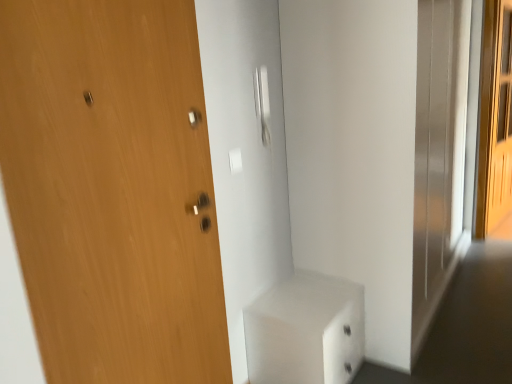
Measure the distance between white glossy cabinet at lower center and camera.

white glossy cabinet at lower center is 1.84 meters away from camera.

Image resolution: width=512 pixels, height=384 pixels. What do you see at coordinates (305, 331) in the screenshot?
I see `white glossy cabinet at lower center` at bounding box center [305, 331].

What do you see at coordinates (495, 123) in the screenshot?
I see `light brown wooden screen door at right` at bounding box center [495, 123].

What is the approximate width of wooden door at left?

1.72 inches.

What do you see at coordinates (262, 103) in the screenshot?
I see `satin silver door handle at center` at bounding box center [262, 103].

The image size is (512, 384). What are the coordinates of `white glossy cabinet at lower center` in the screenshot? It's located at (305, 331).

Does wooden door at left appear on the left side of satin silver door handle at center?

Yes.

Which is behind, point (68, 149) or point (262, 112)?

Positioned behind is point (262, 112).

Consider the image. Do you think wooden door at left is within satin silver door handle at center, or outside of it?

wooden door at left cannot be found inside satin silver door handle at center.

There is a wooden door at left. Identify the location of door handle above it (from a real-world perspective). This screenshot has width=512, height=384. (262, 103).

Can you tell me how much wooden door at left and white glossy cabinet at lower center differ in facing direction?

wooden door at left and white glossy cabinet at lower center are facing 0.00453 degrees away from each other.

Which of these two, wooden door at left or white glossy cabinet at lower center, is smaller?

wooden door at left is smaller.

Which point is more forward, (213, 215) or (336, 317)?

The point (213, 215) is more forward.

Where is `cabinetry on the right of wooden door at left`? The width and height of the screenshot is (512, 384). cabinetry on the right of wooden door at left is located at coordinates (305, 331).

Which of these two, light brown wooden screen door at right or white glossy cabinet at lower center, is bigger?

light brown wooden screen door at right is bigger.

Where is `cabinetry in front of the light brown wooden screen door at right`? The width and height of the screenshot is (512, 384). cabinetry in front of the light brown wooden screen door at right is located at coordinates (305, 331).

Which is correct: light brown wooden screen door at right is inside white glossy cabinet at lower center, or outside of it?

light brown wooden screen door at right is outside white glossy cabinet at lower center.

In terms of width, does light brown wooden screen door at right look wider or thinner when compared to white glossy cabinet at lower center?

Clearly, light brown wooden screen door at right has less width compared to white glossy cabinet at lower center.

From a real-world perspective, is white glossy cabinet at lower center physically above light brown wooden screen door at right?

Actually, white glossy cabinet at lower center is physically below light brown wooden screen door at right in the real world.

Does white glossy cabinet at lower center appear on the left side of light brown wooden screen door at right?

Correct, you'll find white glossy cabinet at lower center to the left of light brown wooden screen door at right.

How distant is white glossy cabinet at lower center from light brown wooden screen door at right?

They are 2.56 meters apart.

Is white glossy cabinet at lower center placed right next to light brown wooden screen door at right?

No, white glossy cabinet at lower center is not next to light brown wooden screen door at right.

Does white glossy cabinet at lower center turn towards wooden door at left?

No.

From the image's perspective, is white glossy cabinet at lower center located above wooden door at left?

No.

How much distance is there between white glossy cabinet at lower center and wooden door at left?

white glossy cabinet at lower center and wooden door at left are 30.67 inches apart from each other.

In the scene shown: Does white glossy cabinet at lower center touch wooden door at left?

No, white glossy cabinet at lower center is not in contact with wooden door at left.

Can you see satin silver door handle at center touching wooden door at left?

No, satin silver door handle at center is not with wooden door at left.

Looking at this image, what's the angular difference between satin silver door handle at center and wooden door at left's facing directions?

0.00823 degrees separate the facing orientations of satin silver door handle at center and wooden door at left.

Which is less distant, (255,92) or (85,24)?

Point (255,92) appears to be farther away from the viewer than point (85,24).

Looking at this image, is satin silver door handle at center positioned with its back to wooden door at left?

No, satin silver door handle at center is not facing the opposite direction of wooden door at left.

Is light brown wooden screen door at right beside wooden door at left?

light brown wooden screen door at right and wooden door at left are not in contact.

From the image's perspective, which one is positioned lower, light brown wooden screen door at right or wooden door at left?

wooden door at left appears lower in the image.

The width and height of the screenshot is (512, 384). Find the location of `door handle that appears behind the wooden door at left`. door handle that appears behind the wooden door at left is located at coordinates (262, 103).

The height and width of the screenshot is (384, 512). I want to click on cabinetry on the right of wooden door at left, so click(x=305, y=331).

Consider the image. When comparing their distances from wooden door at left, does white glossy cabinet at lower center or satin silver door handle at center seem closer?

Based on the image, white glossy cabinet at lower center appears to be nearer to wooden door at left.

Based on their spatial positions, is satin silver door handle at center or white glossy cabinet at lower center closer to light brown wooden screen door at right?

satin silver door handle at center lies closer to light brown wooden screen door at right than the other object.

From the image, which object appears to be farther from wooden door at left, light brown wooden screen door at right or white glossy cabinet at lower center?

light brown wooden screen door at right.

From the image, which object appears to be nearer to wooden door at left, white glossy cabinet at lower center or light brown wooden screen door at right?

white glossy cabinet at lower center lies closer to wooden door at left than the other object.

When comparing their distances from light brown wooden screen door at right, does wooden door at left or satin silver door handle at center seem further?

wooden door at left is further to light brown wooden screen door at right.

Considering their positions, is light brown wooden screen door at right positioned further to wooden door at left than satin silver door handle at center?

light brown wooden screen door at right lies further to wooden door at left than the other object.

Looking at the image, which one is located further to white glossy cabinet at lower center, satin silver door handle at center or light brown wooden screen door at right?

light brown wooden screen door at right is positioned further to the anchor white glossy cabinet at lower center.

Based on their spatial positions, is white glossy cabinet at lower center or light brown wooden screen door at right further from satin silver door handle at center?

Among the two, light brown wooden screen door at right is located further to satin silver door handle at center.

At what (x,y) coordinates should I click in order to perform the action: click on cabinetry situated between wooden door at left and light brown wooden screen door at right from left to right. Please return your answer as a coordinate pair (x, y). This screenshot has width=512, height=384. Looking at the image, I should click on (305, 331).

Where is `door between satin silver door handle at center and white glossy cabinet at lower center in the vertical direction`? door between satin silver door handle at center and white glossy cabinet at lower center in the vertical direction is located at coordinates (112, 190).

The image size is (512, 384). I want to click on door handle between wooden door at left and light brown wooden screen door at right from left to right, so click(x=262, y=103).

The width and height of the screenshot is (512, 384). I want to click on cabinetry located between satin silver door handle at center and light brown wooden screen door at right in the left-right direction, so click(x=305, y=331).